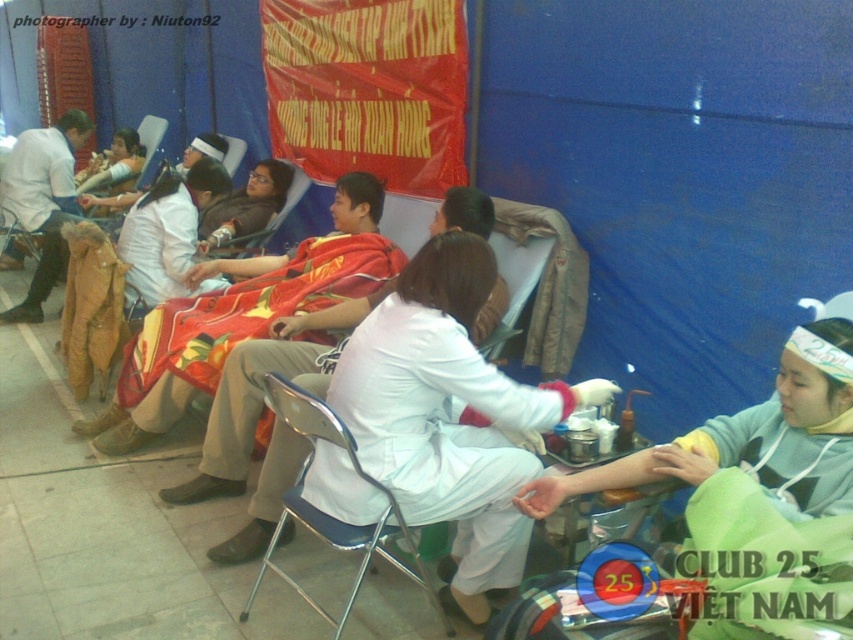
You are a participant at the blood donation event and need to hand a form to the person in the white matte shirt at center. The form is on the table near the matte white coat at center. Can you reach the form without moving the coat?

The matte white coat at center is 3.86 feet away from the white matte shirt at center. Since the form is on the table near the matte white coat at center, you can reach it without needing to move the coat as the distance between them allows access.

You are a blood donor who just arrived at the event and need to reach the metallic blue chair at center to sit down. The path to the chair is clear, but you have a mobility aid that requires 1.8 meters of space to maneuver. Can you safely navigate to the chair?

The distance between the metallic blue chair at center and the viewer is 2.12 meters. Since your mobility aid requires 1.8 meters of space, you have enough room to maneuver safely to the chair.